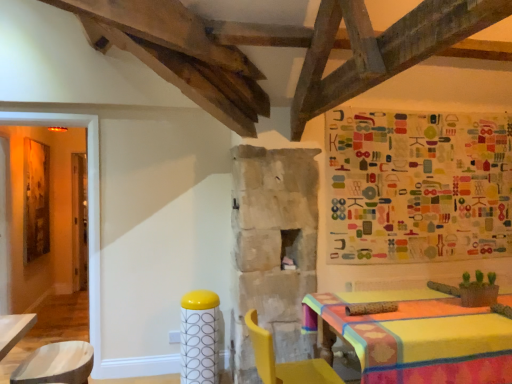
Describe the element at coordinates (199, 337) in the screenshot. This screenshot has height=384, width=512. I see `yellow glossy bar stool at center` at that location.

At what (x,y) coordinates should I click in order to perform the action: click on yellow glossy bar stool at center. Please return your answer as a coordinate pair (x, y). The image size is (512, 384). Looking at the image, I should click on (199, 337).

Is multicolored fabric tapestry at upper right next to yellow plastic chair at lower right?

No, multicolored fabric tapestry at upper right is not beside yellow plastic chair at lower right.

Between multicolored fabric tapestry at upper right and yellow plastic chair at lower right, which one has less height?

With less height is yellow plastic chair at lower right.

This screenshot has height=384, width=512. In order to click on tapestry on the right of the yellow plastic chair at lower right in this screenshot , I will do `click(418, 186)`.

From a real-world perspective, which object rests below the other?

yellow glossy bar stool at center.

Can you confirm if multicolored fabric tapestry at upper right is thinner than yellow glossy bar stool at center?

Indeed, multicolored fabric tapestry at upper right has a lesser width compared to yellow glossy bar stool at center.

Who is smaller, multicolored fabric tapestry at upper right or yellow glossy bar stool at center?

yellow glossy bar stool at center is smaller.

Does point (192, 322) lie in front of point (454, 207)?

Yes, point (192, 322) is in front of point (454, 207).

Is yellow glossy bar stool at center facing away from multicolored fabric tapestry at upper right?

No, multicolored fabric tapestry at upper right is not at the back of yellow glossy bar stool at center.

Is yellow glossy bar stool at center with multicolored fabric tapestry at upper right?

No, yellow glossy bar stool at center is not touching multicolored fabric tapestry at upper right.

Does yellow glossy bar stool at center contain multicolored fabric tapestry at upper right?

No, multicolored fabric tapestry at upper right is not surrounded by yellow glossy bar stool at center.

Is yellow plastic chair at lower right at the left side of yellow glossy bar stool at center?

No, yellow plastic chair at lower right is not to the left of yellow glossy bar stool at center.

Is yellow plastic chair at lower right facing towards yellow glossy bar stool at center?

No, yellow plastic chair at lower right does not turn towards yellow glossy bar stool at center.

Is yellow plastic chair at lower right wider than yellow glossy bar stool at center?

Correct, the width of yellow plastic chair at lower right exceeds that of yellow glossy bar stool at center.

Which is farther from the camera, (260, 330) or (216, 318)?

The point (216, 318) is more distant.

Considering the relative positions of yellow glossy bar stool at center and yellow plastic chair at lower right in the image provided, is yellow glossy bar stool at center behind yellow plastic chair at lower right?

Yes, it is behind yellow plastic chair at lower right.

Which object is thinner, yellow glossy bar stool at center or yellow plastic chair at lower right?

With smaller width is yellow glossy bar stool at center.

From a real-world perspective, who is located lower, yellow glossy bar stool at center or yellow plastic chair at lower right?

yellow glossy bar stool at center.

Is point (190, 315) positioned before point (257, 315)?

That is True.

Is multicolored fabric tapestry at upper right inside yellow plastic chair at lower right?

No, multicolored fabric tapestry at upper right is not inside yellow plastic chair at lower right.

Could you tell me if yellow plastic chair at lower right is facing multicolored fabric tapestry at upper right?

No, yellow plastic chair at lower right is not oriented towards multicolored fabric tapestry at upper right.

Would you say yellow plastic chair at lower right is a long distance from multicolored fabric tapestry at upper right?

Yes, yellow plastic chair at lower right and multicolored fabric tapestry at upper right are quite far apart.

This screenshot has height=384, width=512. I want to click on chair lying below the multicolored fabric tapestry at upper right (from the image's perspective), so click(286, 362).

The width and height of the screenshot is (512, 384). Identify the location of tapestry lying above the yellow glossy bar stool at center (from the image's perspective). (418, 186).

Based on their spatial positions, is yellow plastic chair at lower right or yellow glossy bar stool at center closer to multicolored fabric tapestry at upper right?

yellow plastic chair at lower right is positioned closer to the anchor multicolored fabric tapestry at upper right.

From the image, which object appears to be nearer to multicolored fabric tapestry at upper right, yellow glossy bar stool at center or yellow plastic chair at lower right?

yellow plastic chair at lower right.

Based on their spatial positions, is multicolored fabric tapestry at upper right or yellow plastic chair at lower right further from yellow glossy bar stool at center?

multicolored fabric tapestry at upper right lies further to yellow glossy bar stool at center than the other object.

Considering their positions, is yellow glossy bar stool at center positioned further to yellow plastic chair at lower right than multicolored fabric tapestry at upper right?

multicolored fabric tapestry at upper right is further to yellow plastic chair at lower right.

When comparing their distances from yellow plastic chair at lower right, does multicolored fabric tapestry at upper right or yellow glossy bar stool at center seem further?

Among the two, multicolored fabric tapestry at upper right is located further to yellow plastic chair at lower right.

Estimate the real-world distances between objects in this image. Which object is closer to yellow glossy bar stool at center, yellow plastic chair at lower right or multicolored fabric tapestry at upper right?

yellow plastic chair at lower right.

What are the coordinates of `chair between yellow glossy bar stool at center and multicolored fabric tapestry at upper right` in the screenshot? It's located at (286, 362).